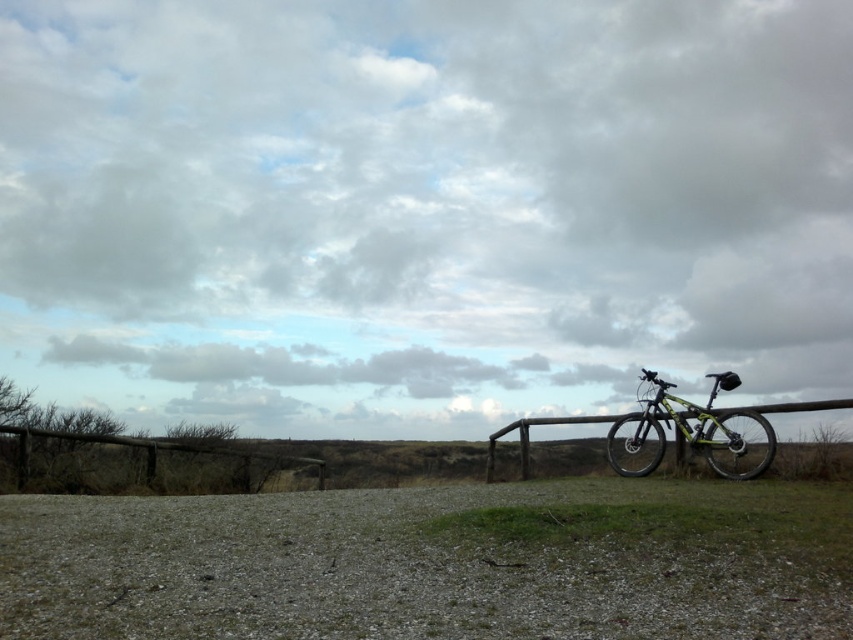
Between gravelly dirt field at lower center and yellow-green matte bicycle at right, which one appears on the left side from the viewer's perspective?

gravelly dirt field at lower center is more to the left.

Is gravelly dirt field at lower center further to the viewer compared to yellow-green matte bicycle at right?

No, gravelly dirt field at lower center is closer to the viewer.

Locate an element on the screen. gravelly dirt field at lower center is located at coordinates (433, 563).

Identify the location of gravelly dirt field at lower center. The image size is (853, 640). tap(433, 563).